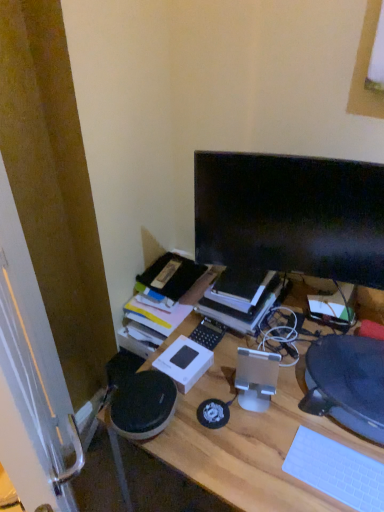
Where is `vacant area on top of white matte keyboard at lower right (from a real-world perspective)`? vacant area on top of white matte keyboard at lower right (from a real-world perspective) is located at coordinates (340, 471).